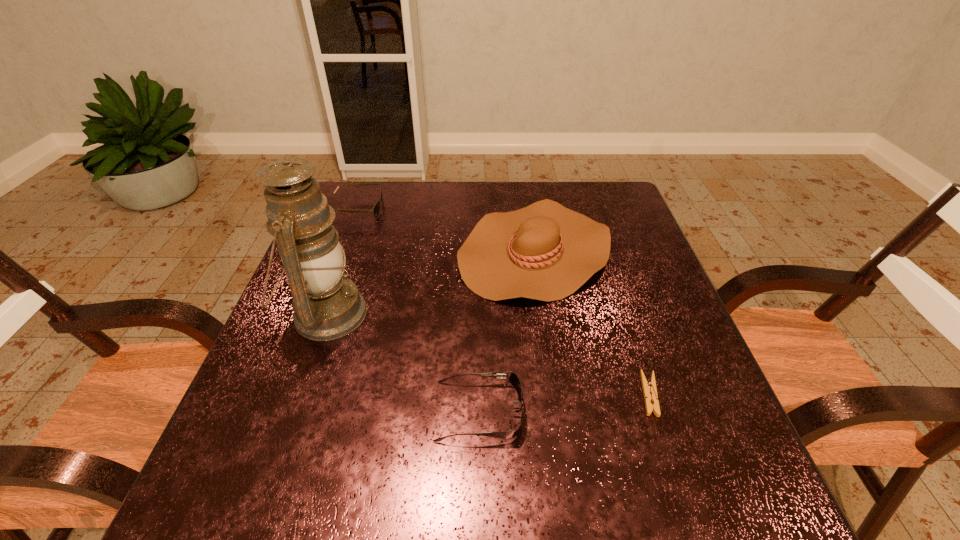
At what (x,y) coordinates should I click in order to perform the action: click on unoccupied area between the right sunglasses and the tallest object. Please return your answer as a coordinate pair (x, y). The image size is (960, 540). Looking at the image, I should click on (403, 362).

Locate an element on the screen. The height and width of the screenshot is (540, 960). free spot between the tallest object and the cowboy hat is located at coordinates (431, 282).

You are a GUI agent. You are given a task and a screenshot of the screen. Output one action in this format:
    pyautogui.click(x=<x>, y=<y>)
    Task: Click on the free space between the fourth shortest object and the tallest object
    The image size is (960, 540).
    Given the screenshot: What is the action you would take?
    pyautogui.click(x=431, y=282)

The height and width of the screenshot is (540, 960). In order to click on empty space between the oil lamp and the cowboy hat in this screenshot , I will do `click(431, 282)`.

Locate an element on the screen. vacant region between the left sunglasses and the fourth tallest object is located at coordinates (418, 310).

Locate an element on the screen. The image size is (960, 540). free area in between the shorter sunglasses and the farther sunglasses is located at coordinates coord(418,310).

Locate which object ranks fourth in proximity to the left sunglasses. Please provide its 2D coordinates. Your answer should be formatted as a tuple, i.e. [(x, y)], where the tuple contains the x and y coordinates of a point satisfying the conditions above.

[(649, 388)]

Select which object is the closest to the cowboy hat. Please provide its 2D coordinates. Your answer should be formatted as a tuple, i.e. [(x, y)], where the tuple contains the x and y coordinates of a point satisfying the conditions above.

[(649, 388)]

You are a GUI agent. You are given a task and a screenshot of the screen. Output one action in this format:
    pyautogui.click(x=<x>, y=<y>)
    Task: Click on the free spot that satisfies the following two spatial constraints: 1. on the front side of the fourth shortest object; 2. on the front-facing side of the nearer sunglasses
    Image resolution: width=960 pixels, height=540 pixels.
    Given the screenshot: What is the action you would take?
    pyautogui.click(x=559, y=411)

Locate an element on the screen. free space that satisfies the following two spatial constraints: 1. on the front side of the shortest object; 2. on the left side of the tallest object is located at coordinates (299, 394).